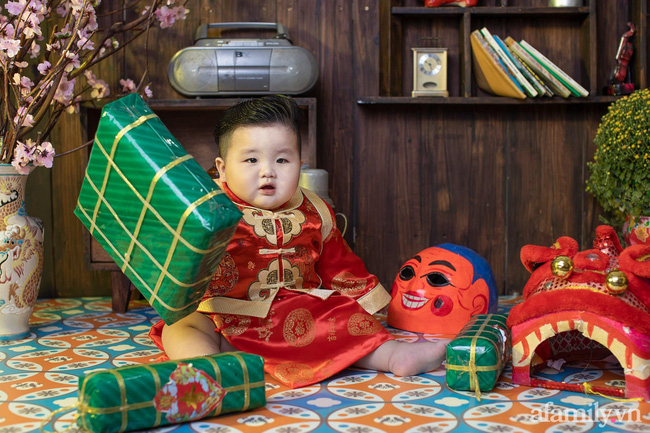
At what (x,y) coordinates should I click in order to perform the action: click on floor. Please return your answer as a coordinate pair (x, y). Looking at the image, I should click on (365, 395).